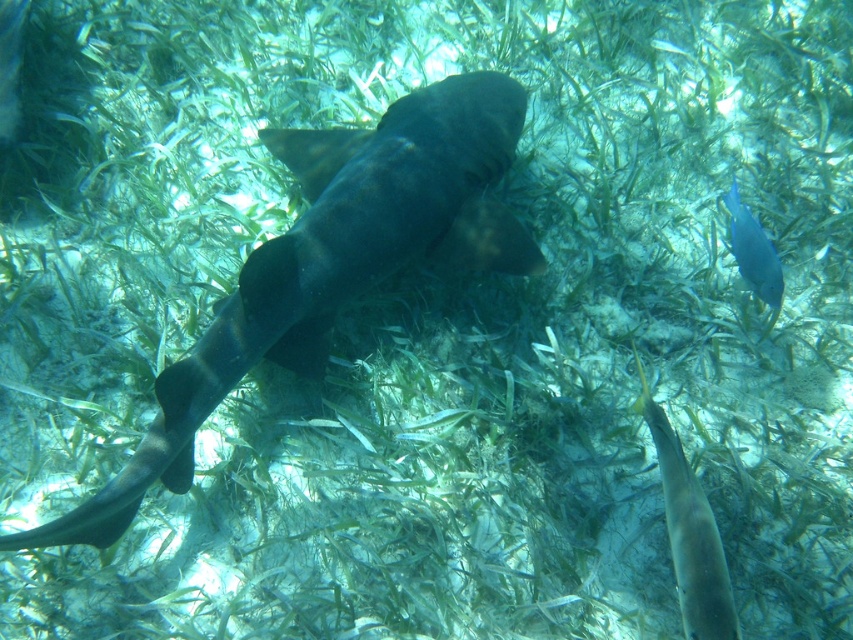
Question: Among these objects, which one is farthest from the camera?

Choices:
 (A) dark gray matte shark at center
 (B) translucent yellowish fish at lower right
 (C) blue glossy fish at upper right

Answer: (C)

Question: Which object appears farthest from the camera in this image?

Choices:
 (A) blue glossy fish at upper right
 (B) dark gray matte shark at center

Answer: (A)

Question: Which of the following is the closest to the observer?

Choices:
 (A) (757, 253)
 (B) (370, 257)

Answer: (A)

Question: Can you confirm if dark gray matte shark at center is bigger than blue glossy fish at upper right?

Choices:
 (A) yes
 (B) no

Answer: (A)

Question: Can you confirm if dark gray matte shark at center is smaller than translucent yellowish fish at lower right?

Choices:
 (A) no
 (B) yes

Answer: (A)

Question: Does dark gray matte shark at center have a smaller size compared to translucent yellowish fish at lower right?

Choices:
 (A) yes
 (B) no

Answer: (B)